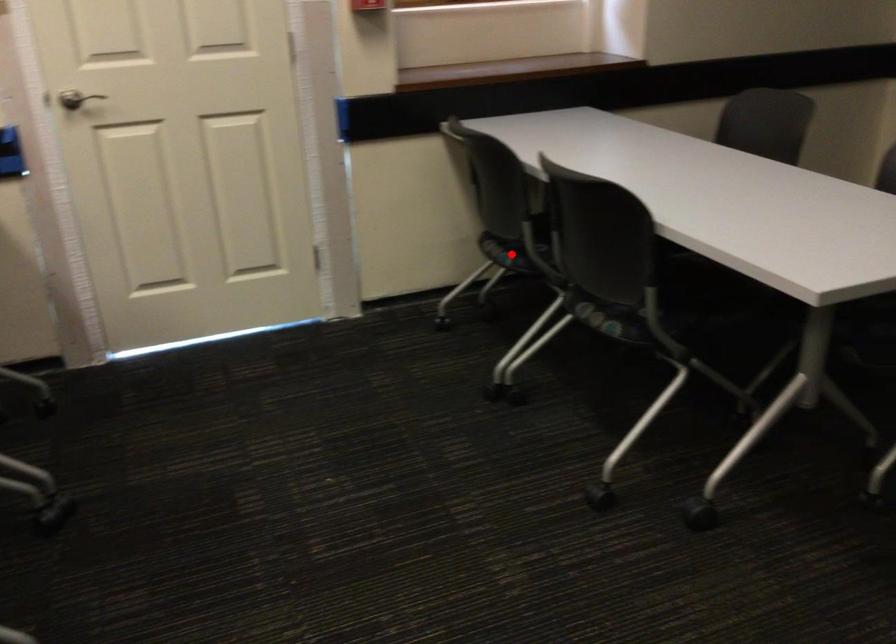
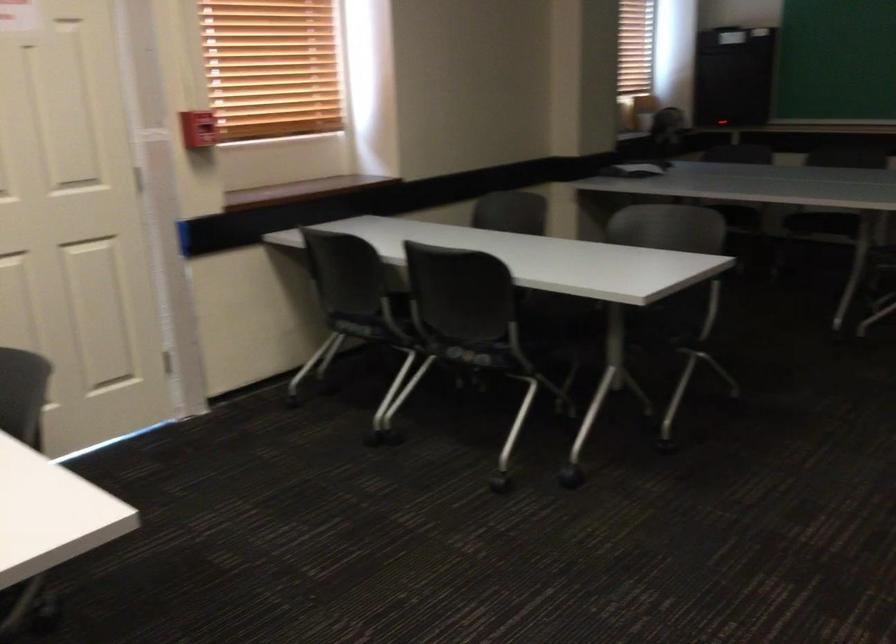
Find the pixel in the second image that matches the highlighted location in the first image.

(360, 328)